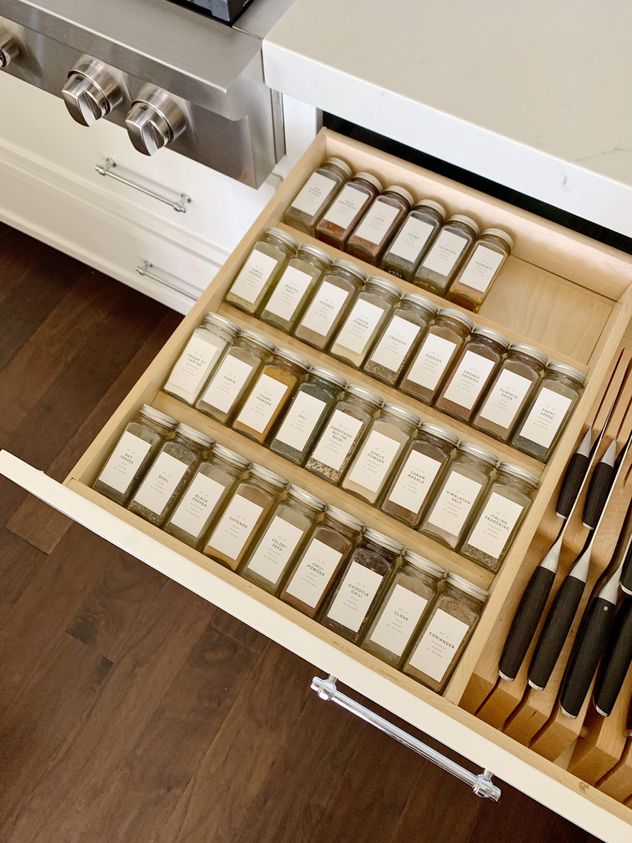
Identify the location of silver handle. This screenshot has width=632, height=843. (434, 760).